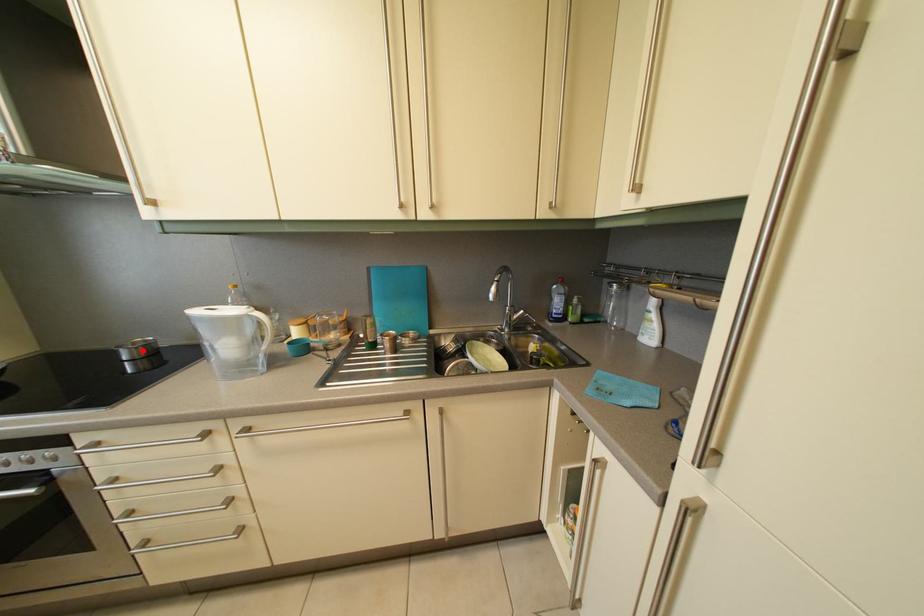
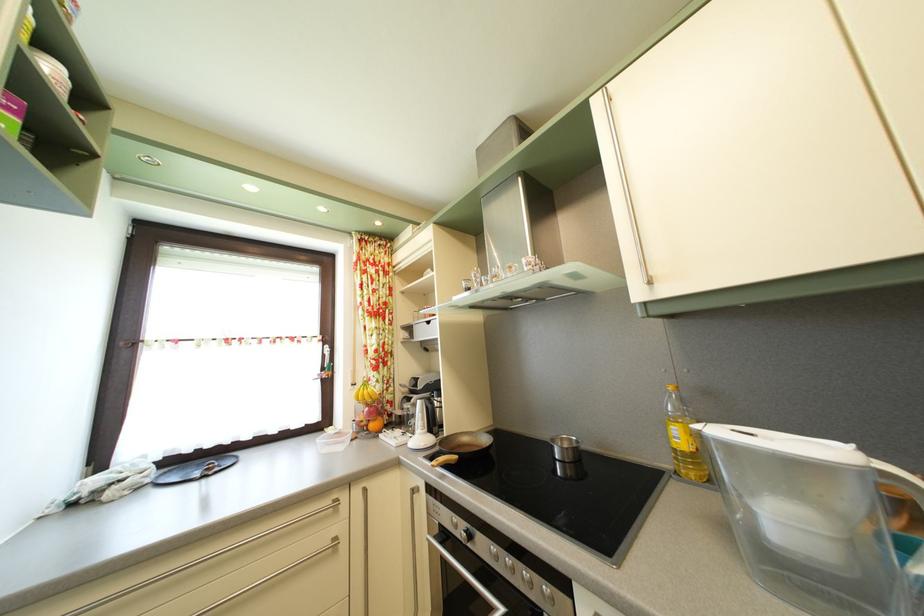
Locate, in the second image, the point that corresponds to the highlighted location in the first image.

(569, 448)